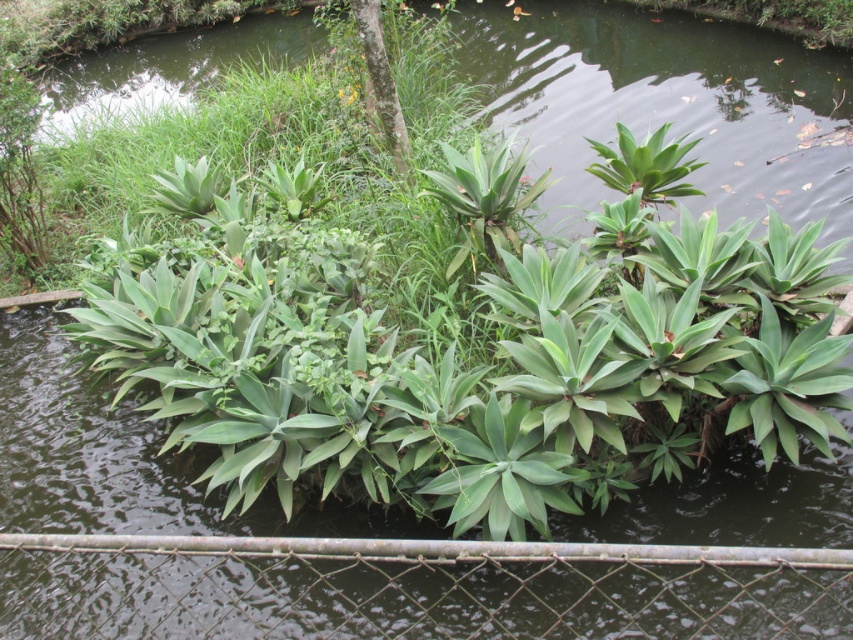
You are a gardener who wants to plant a new flower bed between the rusty metal fence at lower center and the green leafy plant at center. Considering their widths, which object will require more space horizontally to accommodate the flower bed?

The green leafy plant at center requires more horizontal space because its width is greater than the rusty metal fence at lower center.

You are standing at the point with coordinates point (241,406) in the garden. What do you see there?

At point (241,406) lies a green leafy plant at center.